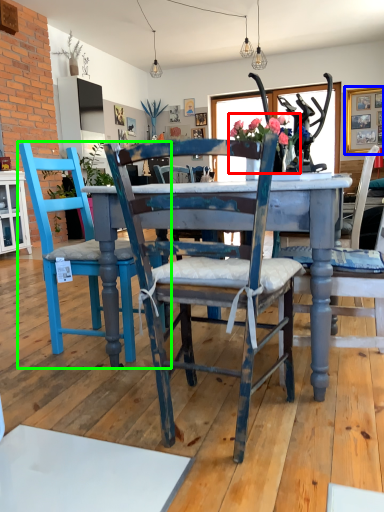
Question: Which is nearer to the floral arrangement (highlighted by a red box)? picture frame (highlighted by a blue box) or chair (highlighted by a green box).

Choices:
 (A) picture frame
 (B) chair

Answer: (B)